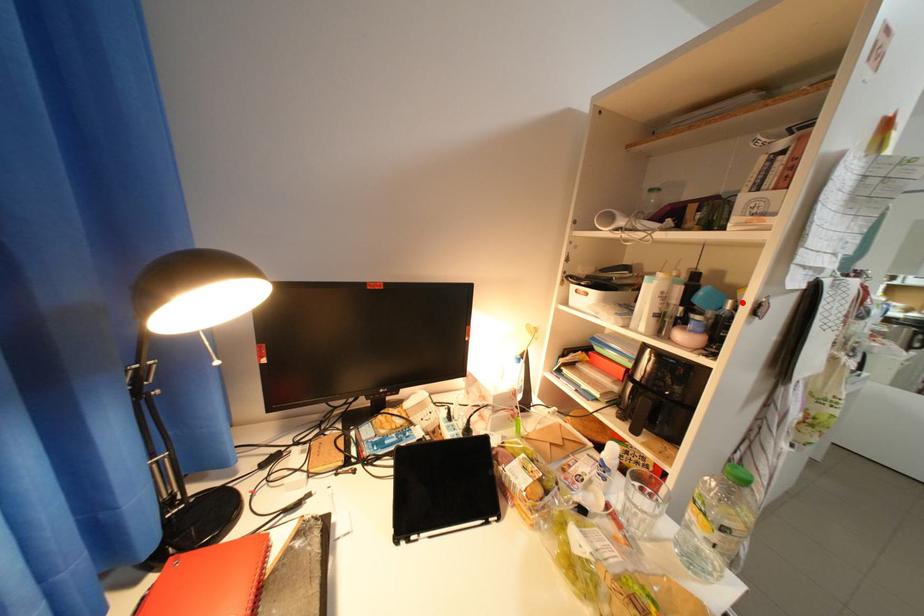
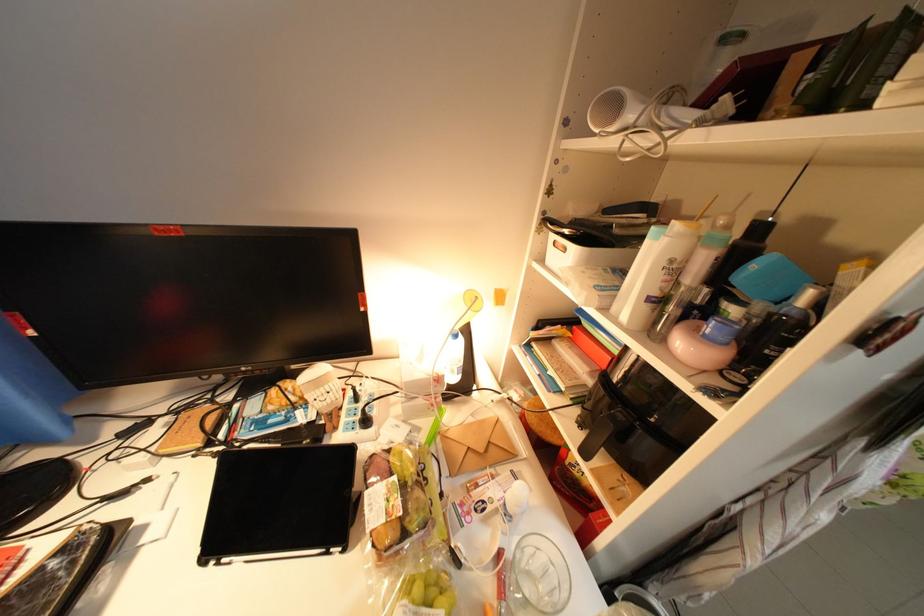
The point at the highlighted location is marked in the first image. Where is the corresponding point in the second image?

(822, 294)